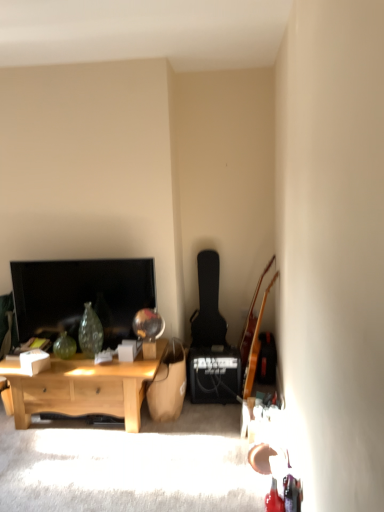
Question: Does matte black tv at left lie behind black matte speaker at lower right?

Choices:
 (A) no
 (B) yes

Answer: (A)

Question: From a real-world perspective, is matte black tv at left below black matte speaker at lower right?

Choices:
 (A) no
 (B) yes

Answer: (A)

Question: Is matte black tv at left shorter than black matte speaker at lower right?

Choices:
 (A) no
 (B) yes

Answer: (A)

Question: Is matte black tv at left closer to camera compared to black matte speaker at lower right?

Choices:
 (A) no
 (B) yes

Answer: (B)

Question: Would you say matte black tv at left is a long distance from black matte speaker at lower right?

Choices:
 (A) yes
 (B) no

Answer: (B)

Question: Is matte black tv at left smaller than black matte speaker at lower right?

Choices:
 (A) yes
 (B) no

Answer: (B)

Question: Does black matte speaker at lower right come in front of black matte guitar at center-right, which is counted as the 1th guitar, starting from the left?

Choices:
 (A) no
 (B) yes

Answer: (B)

Question: Is black matte speaker at lower right positioned beyond the bounds of black matte guitar at center-right, which is counted as the 1th guitar, starting from the left?

Choices:
 (A) yes
 (B) no

Answer: (A)

Question: Is black matte speaker at lower right oriented away from black matte guitar at center-right, which is the second guitar from front to back?

Choices:
 (A) no
 (B) yes

Answer: (B)

Question: From the image's perspective, is black matte speaker at lower right located above black matte guitar at center-right, which is counted as the 1th guitar, starting from the left?

Choices:
 (A) no
 (B) yes

Answer: (A)

Question: From the image's perspective, is black matte speaker at lower right below black matte guitar at center-right, which is the second guitar from front to back?

Choices:
 (A) yes
 (B) no

Answer: (A)

Question: From a real-world perspective, is black matte speaker at lower right physically above black matte guitar at center-right, which is the first guitar in back-to-front order?

Choices:
 (A) yes
 (B) no

Answer: (B)

Question: Is wooden acoustic guitar at right, the 2th guitar from the back, at the back of light wood desk at lower left?

Choices:
 (A) no
 (B) yes

Answer: (A)